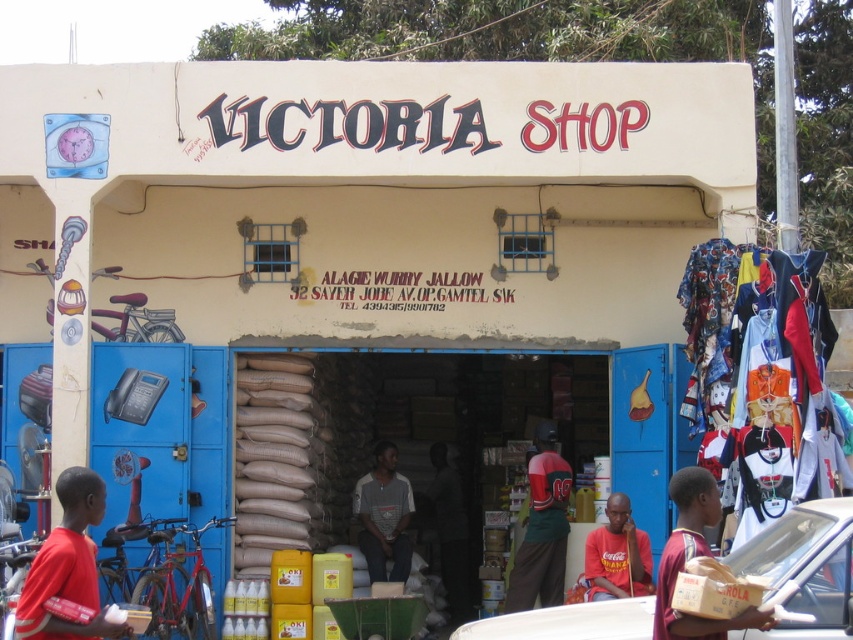
You are a customer entering the Victoria Shop. You see a white plastic car at lower right and a gray striped shirt at center. Which item is positioned higher from the floor?

The white plastic car at lower right is positioned higher than the gray striped shirt at center because it is above it.

You are a delivery person who needs to place a new package on the green jersey at center in the Victoria Shop. The package is 12 meters long. Can you safely place it there without overlapping the brown cardboard box at lower right?

The distance between the green jersey at center and the brown cardboard box at lower right is 11.95 meters. Since the package is 12 meters long, placing it would cause it to overlap the brown cardboard box at lower right. Therefore, it cannot be safely placed there.